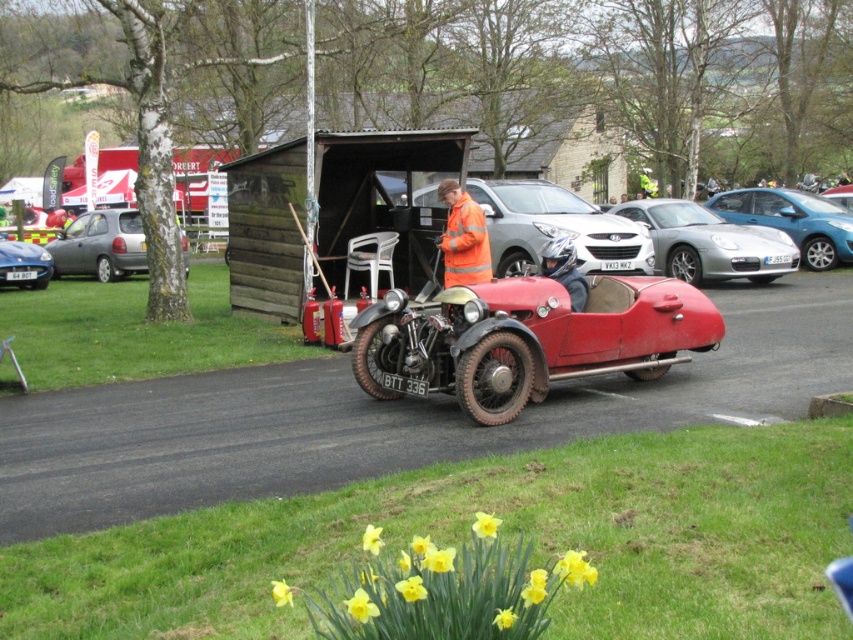
Can you confirm if silver metallic car at center is thinner than silver metallic hatchback at left?

No.

Between point (689, 208) and point (73, 227), which one is positioned in front?

Point (689, 208) is in front.

Image resolution: width=853 pixels, height=640 pixels. I want to click on silver metallic car at center, so click(709, 243).

Where is `silver metallic car at center`? silver metallic car at center is located at coordinates (709, 243).

Can you confirm if metallic blue car at center is thinner than silver metallic hatchback at left?

In fact, metallic blue car at center might be wider than silver metallic hatchback at left.

Between metallic blue car at center and silver metallic hatchback at left, which one appears on the right side from the viewer's perspective?

metallic blue car at center is more to the right.

Which is in front, point (805, 260) or point (97, 280)?

Point (805, 260) is in front.

Locate an element on the screen. The image size is (853, 640). metallic blue car at center is located at coordinates (793, 220).

Does point (274, 595) come closer to viewer compared to point (119, 212)?

Yes, point (274, 595) is closer to viewer.

Can you confirm if yellow matte daffodil at lower center is positioned to the left of silver metallic hatchback at left?

No, yellow matte daffodil at lower center is not to the left of silver metallic hatchback at left.

The image size is (853, 640). Describe the element at coordinates (445, 589) in the screenshot. I see `yellow matte daffodil at lower center` at that location.

The width and height of the screenshot is (853, 640). Identify the location of yellow matte daffodil at lower center. (445, 589).